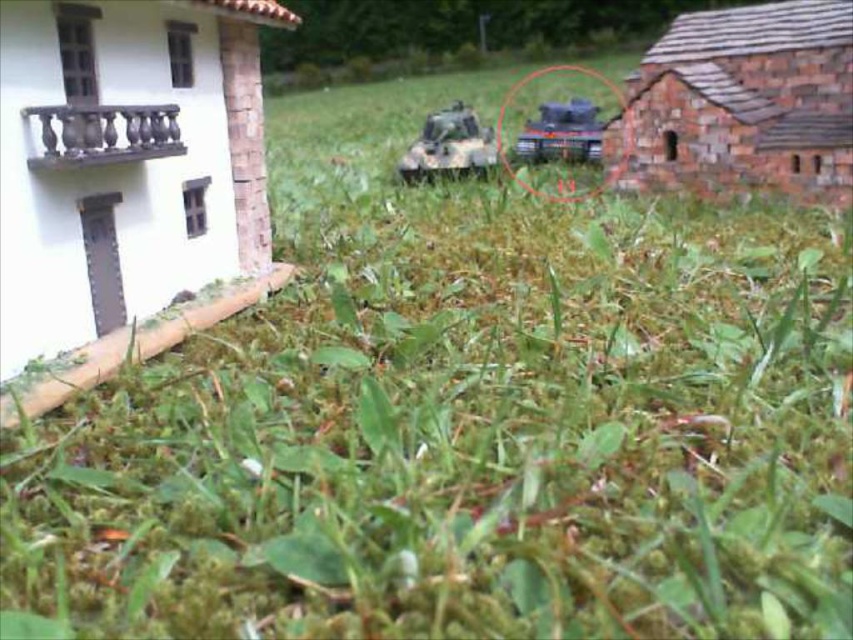
Question: Is camouflage plastic tank at center closer to the viewer compared to brushed metal tank at center?

Choices:
 (A) yes
 (B) no

Answer: (A)

Question: Is camouflage plastic tank at center below brushed metal tank at center?

Choices:
 (A) no
 (B) yes

Answer: (B)

Question: Is camouflage plastic tank at center below brushed metal tank at center?

Choices:
 (A) yes
 (B) no

Answer: (A)